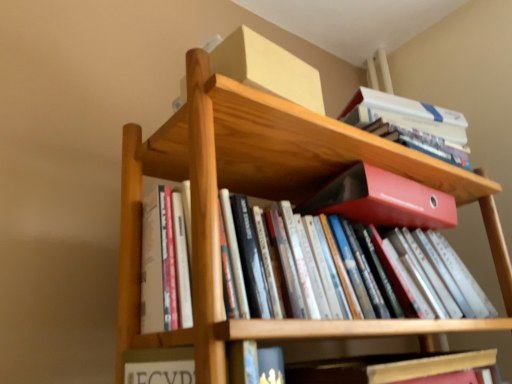
Question: From a real-world perspective, is white paperback book at upper right, positioned as the first book in top-to-bottom order, beneath hardcover book at lower center, which is counted as the first book, starting from the bottom?

Choices:
 (A) no
 (B) yes

Answer: (A)

Question: Can you confirm if white paperback book at upper right, positioned as the first book in top-to-bottom order, is shorter than hardcover book at lower center, which is counted as the first book, starting from the bottom?

Choices:
 (A) yes
 (B) no

Answer: (B)

Question: Is white paperback book at upper right, which appears as the second book when ordered from the bottom, bigger than hardcover book at lower center, positioned as the second book in top-to-bottom order?

Choices:
 (A) yes
 (B) no

Answer: (A)

Question: Is white paperback book at upper right, the first book from the back, aimed at hardcover book at lower center, which ranks as the second book in back-to-front order?

Choices:
 (A) yes
 (B) no

Answer: (B)

Question: Is white paperback book at upper right, which appears as the second book when ordered from the bottom, surrounding hardcover book at lower center, positioned as the first book in front-to-back order?

Choices:
 (A) no
 (B) yes

Answer: (A)

Question: Visually, is wooden bookshelf at center positioned to the left or to the right of hardcover book at lower center, positioned as the second book in top-to-bottom order?

Choices:
 (A) right
 (B) left

Answer: (B)

Question: From a real-world perspective, is wooden bookshelf at center physically located above or below hardcover book at lower center, which ranks as the second book in back-to-front order?

Choices:
 (A) above
 (B) below

Answer: (A)

Question: From their relative heights in the image, would you say wooden bookshelf at center is taller or shorter than hardcover book at lower center, which is counted as the first book, starting from the bottom?

Choices:
 (A) short
 (B) tall

Answer: (B)

Question: Considering the positions of wooden bookshelf at center and hardcover book at lower center, which is counted as the first book, starting from the bottom, in the image, is wooden bookshelf at center bigger or smaller than hardcover book at lower center, which is counted as the first book, starting from the bottom,?

Choices:
 (A) big
 (B) small

Answer: (A)

Question: In terms of size, does hardcover book at lower center, positioned as the second book in top-to-bottom order, appear bigger or smaller than wooden bookshelf at center?

Choices:
 (A) small
 (B) big

Answer: (A)

Question: Is hardcover book at lower center, which is counted as the first book, starting from the bottom, situated inside wooden bookshelf at center or outside?

Choices:
 (A) inside
 (B) outside

Answer: (B)

Question: Considering the positions of hardcover book at lower center, which ranks as the second book in back-to-front order, and wooden bookshelf at center in the image, is hardcover book at lower center, which ranks as the second book in back-to-front order, wider or thinner than wooden bookshelf at center?

Choices:
 (A) thin
 (B) wide

Answer: (B)

Question: From a real-world perspective, is hardcover book at lower center, positioned as the second book in top-to-bottom order, above or below wooden bookshelf at center?

Choices:
 (A) below
 (B) above

Answer: (A)

Question: Is matte red folder at center inside the boundaries of hardcover book at lower center, positioned as the first book in front-to-back order, or outside?

Choices:
 (A) inside
 (B) outside

Answer: (B)

Question: Would you say matte red folder at center is to the left or to the right of hardcover book at lower center, positioned as the second book in top-to-bottom order, in the picture?

Choices:
 (A) left
 (B) right

Answer: (B)